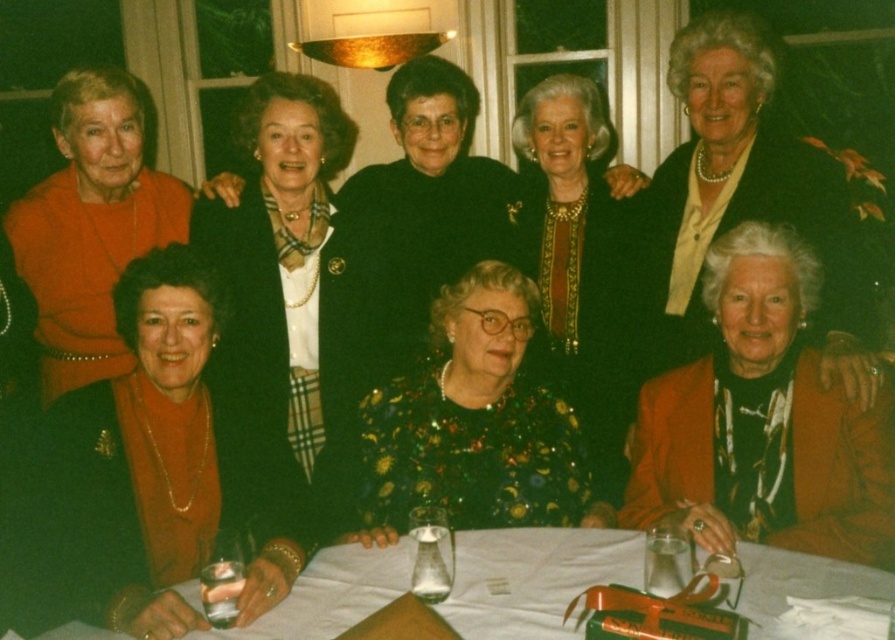
Question: Is matte black blazer at center further to camera compared to white cloth at lower center?

Choices:
 (A) no
 (B) yes

Answer: (B)

Question: Is matte orange jacket at lower right above shiny gold necklace at center?

Choices:
 (A) yes
 (B) no

Answer: (B)

Question: Which of these objects is positioned closest to the matte orange sweater at lower left?

Choices:
 (A) floral-patterned dress at center
 (B) shiny gold necklace at center
 (C) matte orange dress at lower left

Answer: (A)

Question: Which object appears closest to the camera in this image?

Choices:
 (A) matte orange dress at lower left
 (B) matte orange sweater at lower left
 (C) shiny gold necklace at center

Answer: (B)

Question: Is matte orange sweater at lower left wider than matte orange dress at lower left?

Choices:
 (A) yes
 (B) no

Answer: (A)

Question: Which of these objects is positioned farthest from the matte orange dress at lower left?

Choices:
 (A) floral-patterned dress at center
 (B) matte black jacket at lower right
 (C) white cloth at lower center
 (D) matte black blazer at center

Answer: (B)